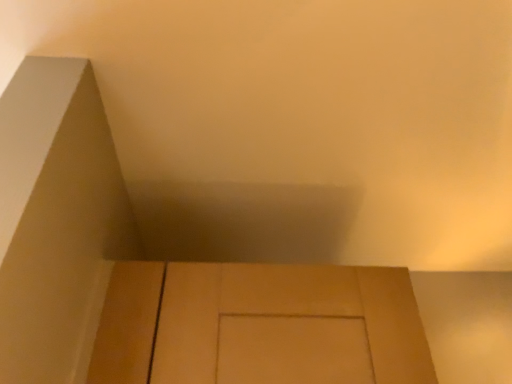
Based on the photo, measure the distance between matte cardboard box at upper left and camera.

matte cardboard box at upper left and camera are 18.21 inches apart.

This screenshot has height=384, width=512. Describe the element at coordinates (162, 273) in the screenshot. I see `matte cardboard box at upper left` at that location.

Image resolution: width=512 pixels, height=384 pixels. I want to click on matte cardboard box at upper left, so click(162, 273).

The width and height of the screenshot is (512, 384). I want to click on matte cardboard box at upper left, so click(162, 273).